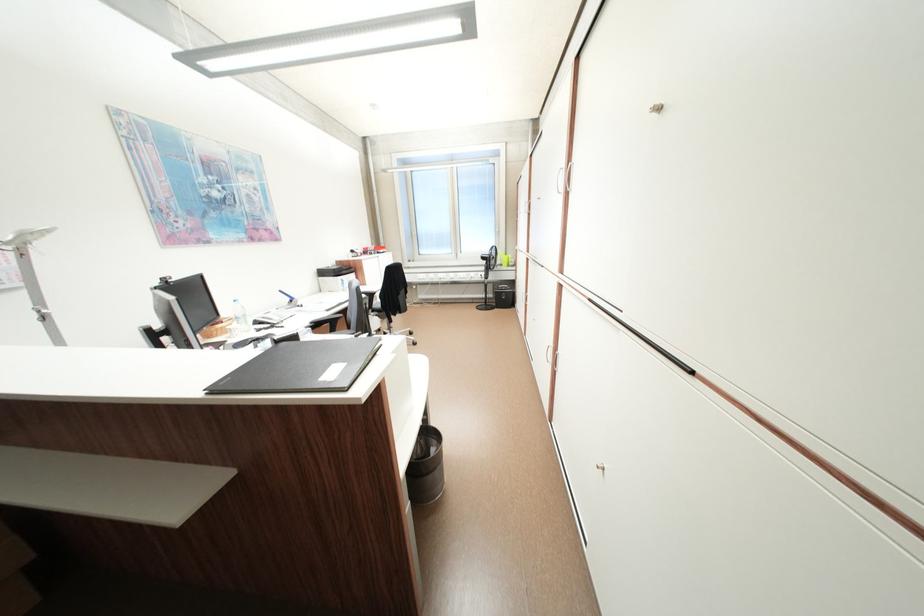
Where would you lift the telephone handset? Please return your answer as a coordinate pair (x, y).

(273, 315)